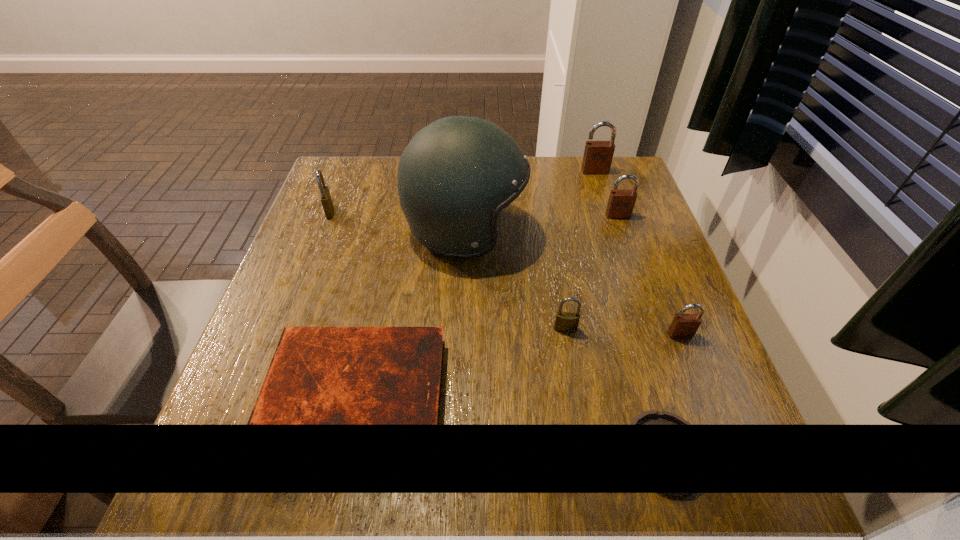
This screenshot has width=960, height=540. In the image, there is a desktop. Find the location of `vacant space at the far edge`. vacant space at the far edge is located at coordinates (565, 157).

You are a GUI agent. You are given a task and a screenshot of the screen. Output one action in this format:
    pyautogui.click(x=<x>, y=<y>)
    Task: Click on the free space at the near edge of the desktop
    This screenshot has height=540, width=960.
    Given the screenshot: What is the action you would take?
    pyautogui.click(x=614, y=514)

Identify the location of free point at the left edge. This screenshot has height=540, width=960. (331, 283).

Where is `free space at the right edge of the desktop`? This screenshot has height=540, width=960. free space at the right edge of the desktop is located at coordinates (645, 389).

Locate an element on the screen. vacant space at the far left corner of the desktop is located at coordinates (378, 168).

In the image, there is a desktop. Identify the location of vacant space at the far right corner. (622, 185).

This screenshot has height=540, width=960. What are the coordinates of `blank region between the football helmet and the smaller brass padlock` in the screenshot? It's located at (516, 280).

Where is `vacant point located between the tallest padlock and the nearest brown padlock`? The width and height of the screenshot is (960, 540). vacant point located between the tallest padlock and the nearest brown padlock is located at coordinates (637, 253).

Find the location of a particular element. free spot between the green football helmet and the farther brass padlock is located at coordinates (397, 222).

At what (x,y) coordinates should I click in order to perform the action: click on vacant space that's between the smallest brown padlock and the farthest padlock. Please return your answer as a coordinate pair (x, y). Image resolution: width=960 pixels, height=540 pixels. Looking at the image, I should click on (637, 253).